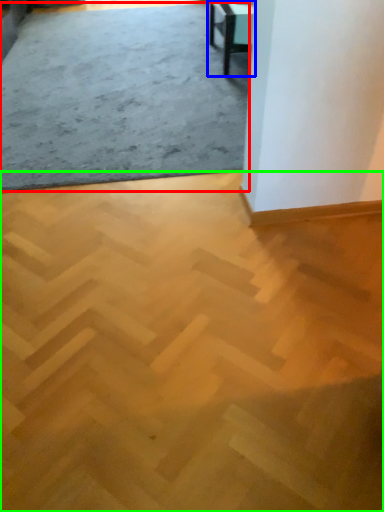
Question: Which is farther away from concrete (highlighted by a red box)? table (highlighted by a blue box) or concrete (highlighted by a green box)?

Choices:
 (A) table
 (B) concrete

Answer: (B)